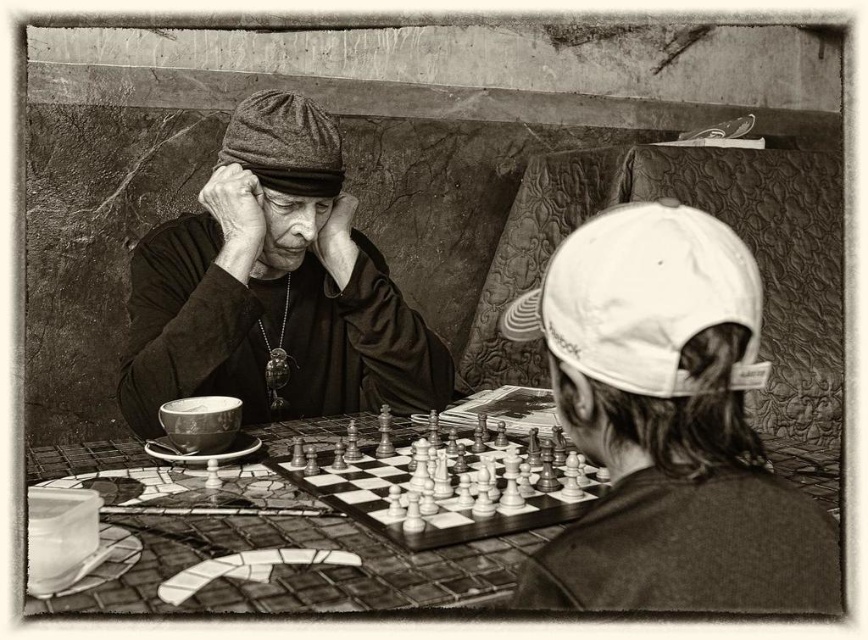
Question: Considering the real-world distances, which object is closest to the mosaic tile table at center?

Choices:
 (A) dark woolen cap at upper left
 (B) wooden chessboard at center

Answer: (B)

Question: Where is dark woolen cap at upper left located in relation to white fabric baseball cap at upper right in the image?

Choices:
 (A) above
 (B) below

Answer: (A)

Question: Which object appears farthest from the camera in this image?

Choices:
 (A) mosaic tile table at center
 (B) dark woolen cap at upper left
 (C) wooden chessboard at center

Answer: (B)

Question: Does mosaic tile table at center have a greater width compared to wooden chessboard at center?

Choices:
 (A) yes
 (B) no

Answer: (A)

Question: Which object appears closest to the camera in this image?

Choices:
 (A) white fabric baseball cap at upper right
 (B) wooden chessboard at center
 (C) mosaic tile table at center

Answer: (A)

Question: Is mosaic tile table at center thinner than gray woolen baseball cap at upper center?

Choices:
 (A) yes
 (B) no

Answer: (B)